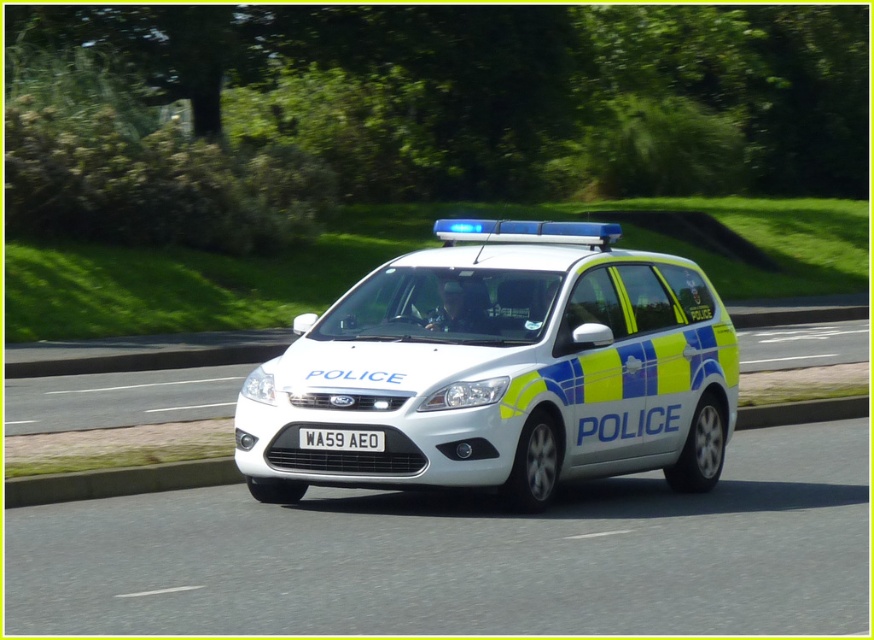
You are a photographer trying to capture a clear photo of the white plastic license plate at center while the white glossy police car at center is moving. Considering their sizes, which object should you focus on first to ensure the license plate is visible?

The white glossy police car at center is larger than the white plastic license plate at center, so you should focus on the white glossy police car at center first to ensure the license plate is visible.

In the scene shown: You are a pedestrian standing on the sidewalk observing the white glossy police car at center and the white plastic license plate at center. Which object is positioned higher from the ground?

The white glossy police car at center is positioned higher from the ground than the white plastic license plate at center.

You are a photographer trying to capture the police vehicle. You notice two points on the car, namely point (442, 380) and point (325, 449). Which of these points is nearer to your camera?

Point (442, 380) is closer to the camera than point (325, 449).